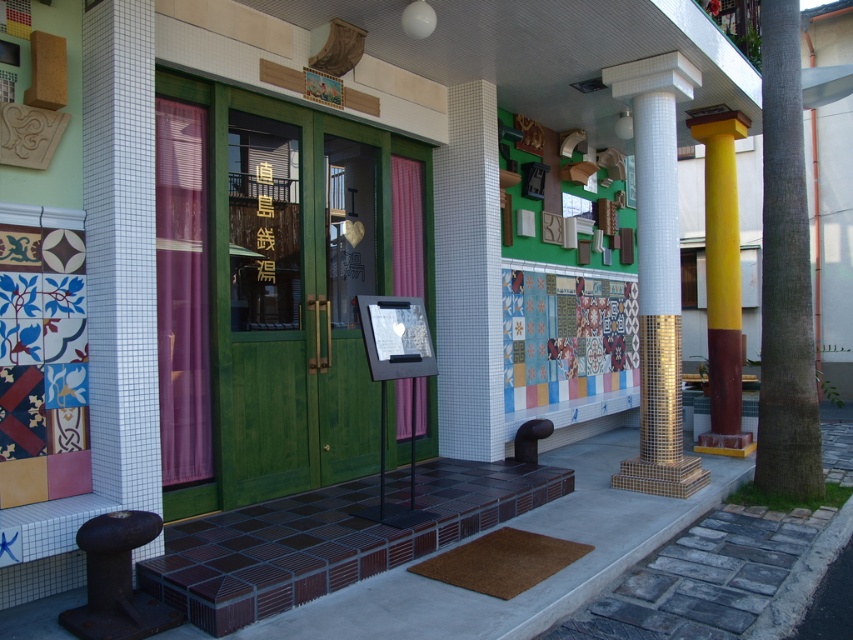
Question: Which point is closer to the camera?

Choices:
 (A) (730, 516)
 (B) (788, 362)
 (C) (296, 481)
 (D) (733, 372)

Answer: (C)

Question: Is brown textured pillar at right closer to the viewer compared to yellow mosaic column at right?

Choices:
 (A) yes
 (B) no

Answer: (A)

Question: Is green wooden door at center positioned behind yellow mosaic column at right?

Choices:
 (A) yes
 (B) no

Answer: (B)

Question: Which point is farther from the camera taking this photo?

Choices:
 (A) (368, 454)
 (B) (303, 625)
 (C) (763, 74)

Answer: (C)

Question: Observing the image, what is the correct spatial positioning of brown brick pavement at lower center in reference to brown textured pillar at right?

Choices:
 (A) below
 (B) above

Answer: (A)

Question: Which object is farther from the camera taking this photo?

Choices:
 (A) green matte wood door at center
 (B) brown textured pillar at right
 (C) green wooden door at center
 (D) brown brick pavement at lower center

Answer: (B)